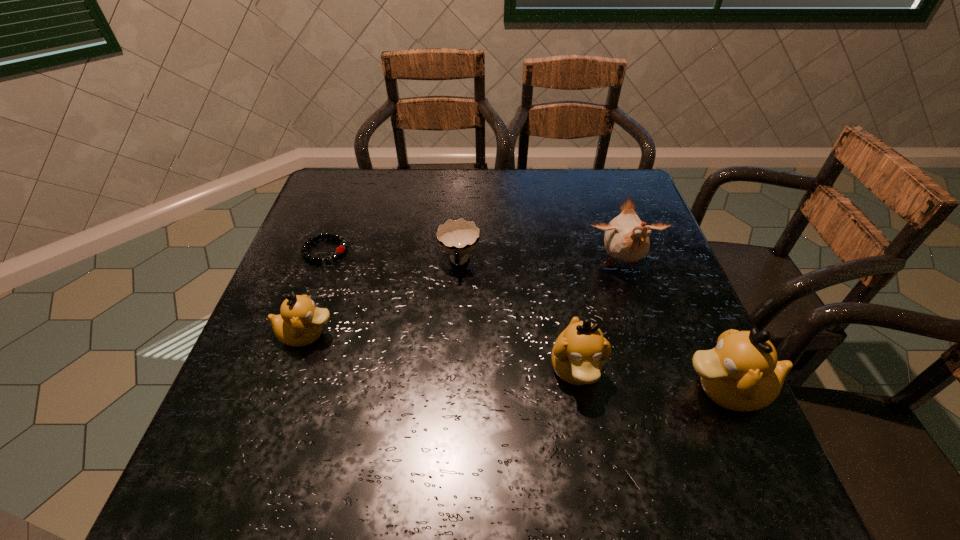
You are a GUI agent. You are given a task and a screenshot of the screen. Output one action in this format:
    pyautogui.click(x=<x>, y=<y>)
    Task: Click on the free spot located 0.050m on the face of the second duckling from right to left
    This screenshot has height=540, width=960.
    Given the screenshot: What is the action you would take?
    pyautogui.click(x=587, y=430)

Where is `free space located 0.210m on the face of the rightmost duckling`? This screenshot has height=540, width=960. free space located 0.210m on the face of the rightmost duckling is located at coordinates (569, 389).

The height and width of the screenshot is (540, 960). What are the coordinates of `vacant area situated on the face of the rightmost duckling` in the screenshot? It's located at (491, 389).

The image size is (960, 540). Find the location of `vacant space located 0.230m on the face of the rightmost duckling`. vacant space located 0.230m on the face of the rightmost duckling is located at coordinates (559, 389).

This screenshot has width=960, height=540. Identify the location of free space located 0.180m on the side of the cup with the handle. coord(455,343).

I want to click on vacant position located at the beak of the bird, so click(636, 308).

Where is `free region located on the front of the shortest object`? Image resolution: width=960 pixels, height=540 pixels. free region located on the front of the shortest object is located at coordinates (294, 333).

Where is `duckling situated at the left edge`? The width and height of the screenshot is (960, 540). duckling situated at the left edge is located at coordinates (300, 322).

At what (x,y) coordinates should I click in order to perform the action: click on bracelet that is at the left edge. Please return your answer as a coordinate pair (x, y). The image size is (960, 540). Looking at the image, I should click on point(340,250).

Find the location of a particular element. duckling positioned at the right edge is located at coordinates (741, 373).